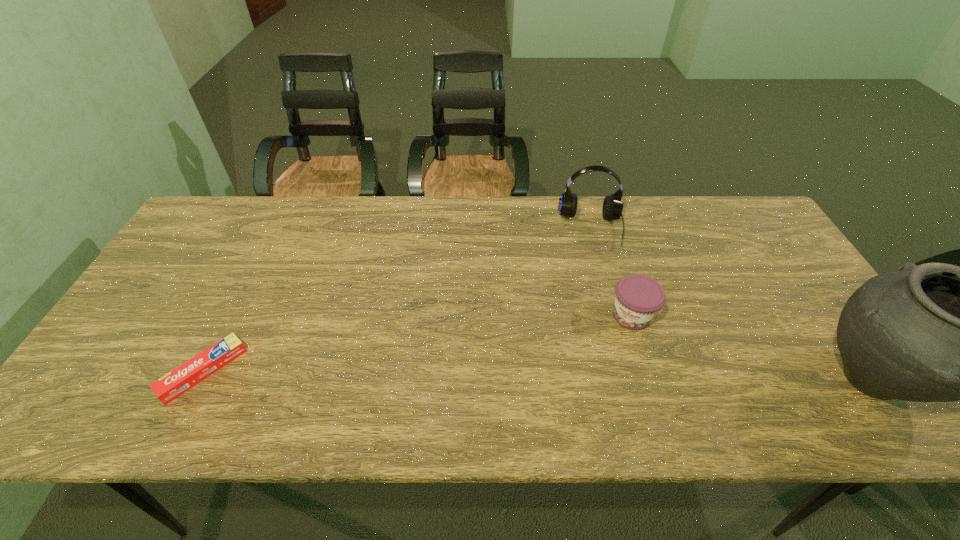
Find the location of `free space on the desktop that is between the toothpaste and the rightmost object and is positioned on the front label of the second shortest object`. free space on the desktop that is between the toothpaste and the rightmost object and is positioned on the front label of the second shortest object is located at coordinates (599, 376).

In order to click on vacant spot on the desktop that is between the leftmost object and the rightmost object and is positioned on the ear cushions of the second tallest object in this screenshot , I will do `click(606, 376)`.